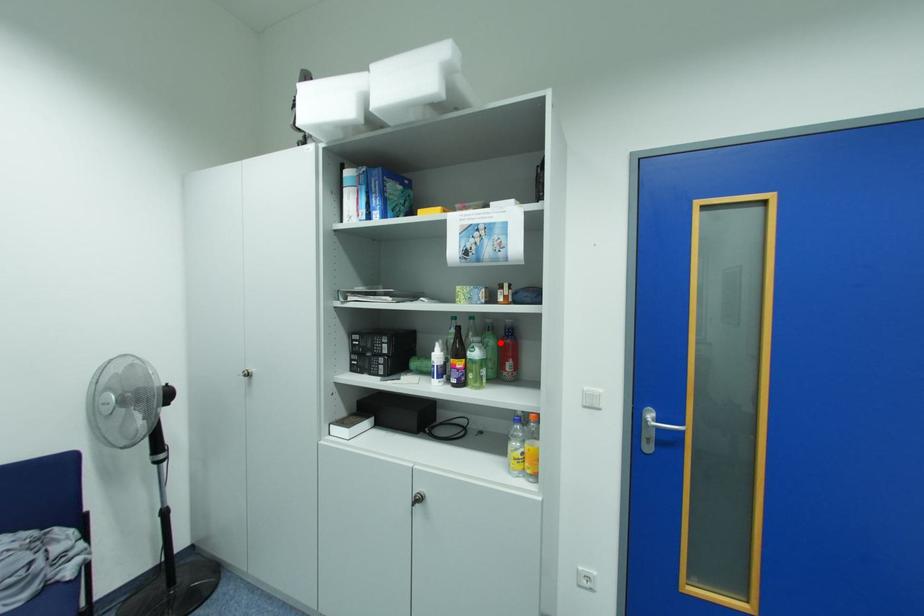
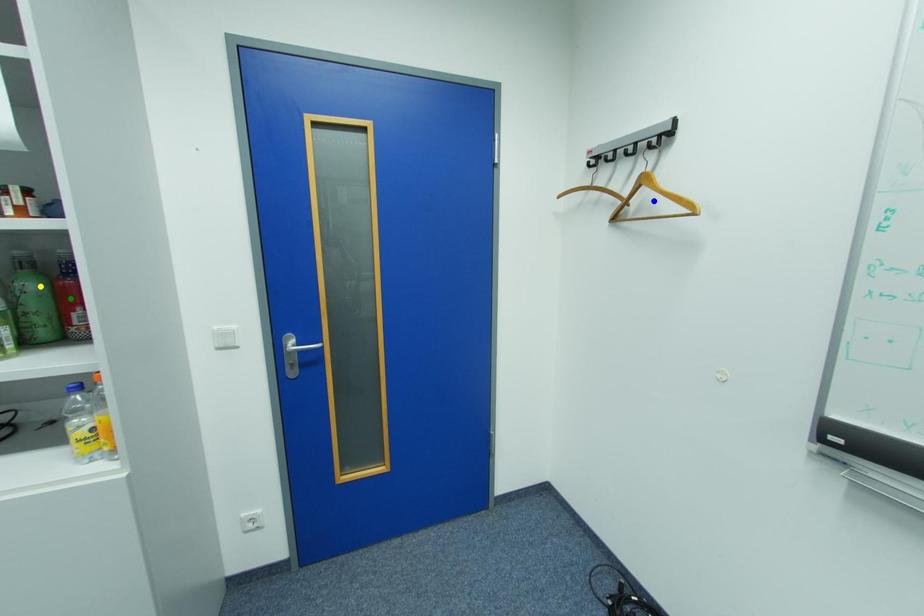
Question: I am providing you with two images of the same scene from different viewpoints. A red point is marked on the first image. You are given multiple points on the second image. Which point in image 2 represents the same 3d spot as the red point in image 1?

Choices:
 (A) green point
 (B) blue point
 (C) yellow point

Answer: (C)